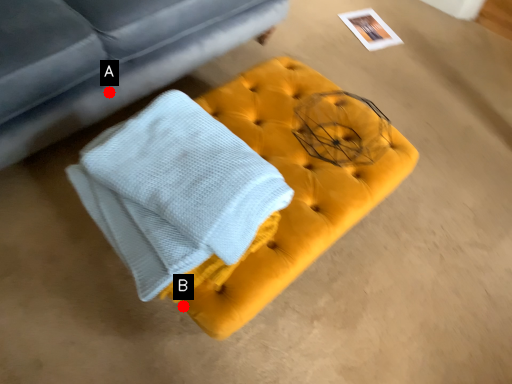
Question: Two points are circled on the image, labeled by A and B beside each circle. Which point is farther from the camera taking this photo?

Choices:
 (A) A is further
 (B) B is further

Answer: (A)